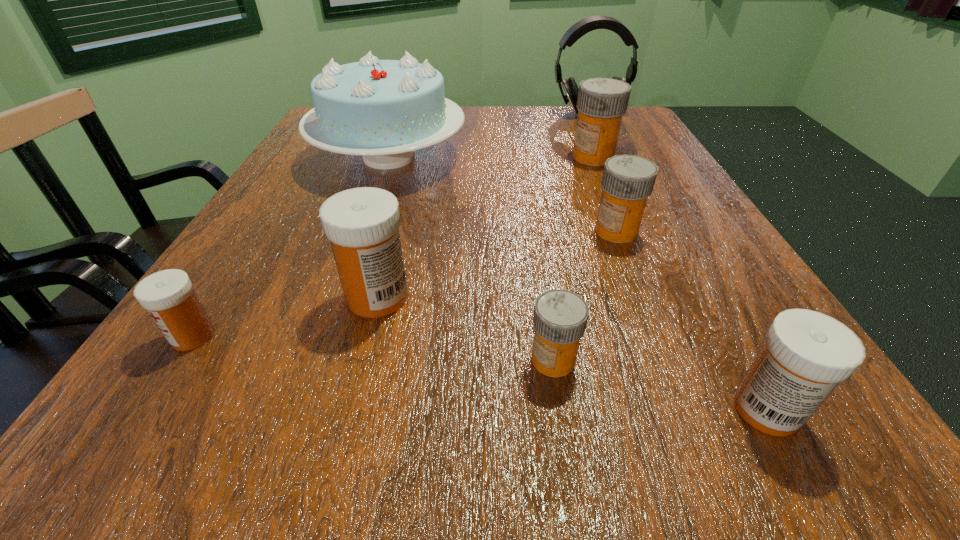
Locate an element on the screen. The height and width of the screenshot is (540, 960). the nearest medicine is located at coordinates (806, 354).

I want to click on the leftmost white medicine, so click(168, 296).

Image resolution: width=960 pixels, height=540 pixels. In order to click on the smallest white medicine in this screenshot , I will do `click(168, 296)`.

Locate an element on the screen. the fourth medicine from right to left is located at coordinates (560, 317).

Find the location of a particular element. This screenshot has height=540, width=960. the nearest orange medicine is located at coordinates (560, 317).

Identify the location of vacant space located on the ear cups of the earphone. (598, 133).

You are a GUI agent. You are given a task and a screenshot of the screen. Output one action in this format:
    pyautogui.click(x=<x>, y=<y>)
    Task: Click on the vacant region located on the right of the blue birthday cake
    
    Given the screenshot: What is the action you would take?
    pyautogui.click(x=526, y=157)

Locate an element on the screen. vacant space situated 0.260m on the label side of the biggest orange medicine is located at coordinates click(x=450, y=157).

The height and width of the screenshot is (540, 960). In order to click on vacant point located 0.350m on the label side of the biggest orange medicine in this screenshot , I will do `click(409, 157)`.

Find the location of a particular element. Image resolution: width=960 pixels, height=540 pixels. vacant point located 0.220m on the label side of the biggest orange medicine is located at coordinates (469, 157).